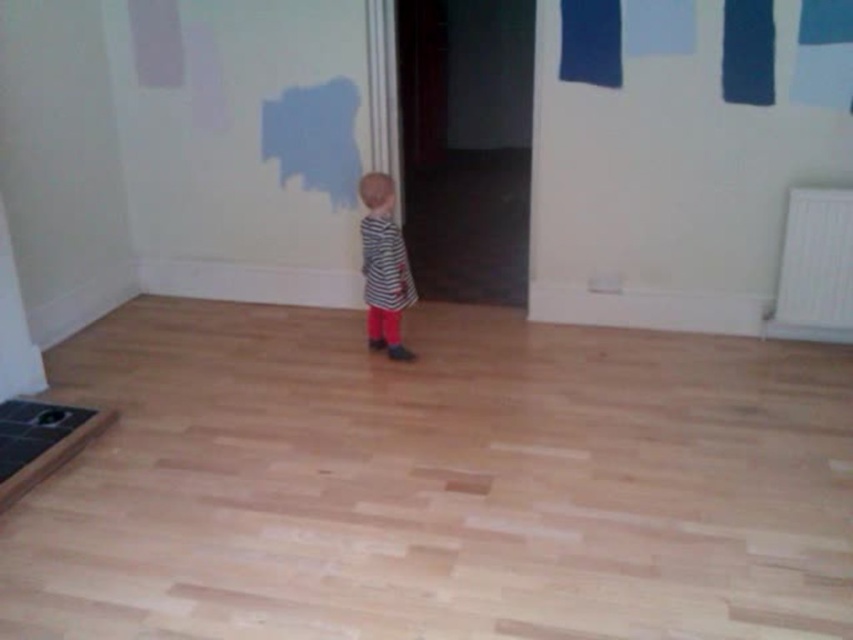
Question: Is white plastic radiator at right wider than striped fabric dress at center?

Choices:
 (A) yes
 (B) no

Answer: (A)

Question: Which of the following is the farthest from the observer?

Choices:
 (A) striped fabric dress at center
 (B) white plastic radiator at right
 (C) dark blue fabric at upper right

Answer: (A)

Question: Is dark blue fabric at upper right to the left of white plastic radiator at right from the viewer's perspective?

Choices:
 (A) no
 (B) yes

Answer: (B)

Question: Among these points, which one is farthest from the camera?

Choices:
 (A) (843, 259)
 (B) (383, 272)
 (C) (767, 58)

Answer: (A)

Question: Which point is closer to the camera?

Choices:
 (A) (799, 333)
 (B) (840, 0)

Answer: (B)

Question: Is the position of dark blue fabric at upper right more distant than that of white plastic radiator at right?

Choices:
 (A) yes
 (B) no

Answer: (B)